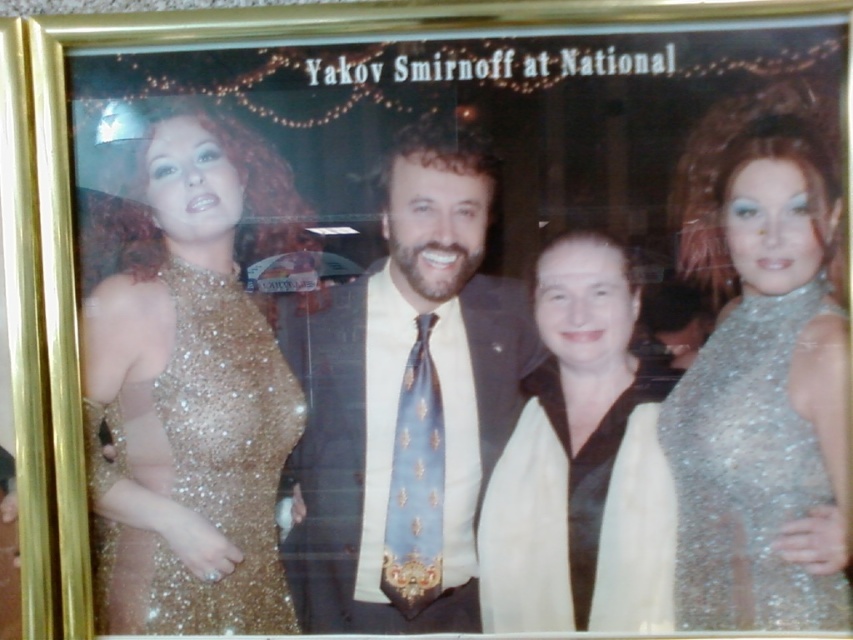
Question: Which point appears closest to the camera in this image?

Choices:
 (A) (558, 573)
 (B) (428, 497)
 (C) (721, 452)

Answer: (C)

Question: Is satin white scarf at center smaller than sparkly silver dress at right?

Choices:
 (A) yes
 (B) no

Answer: (B)

Question: Which object appears farthest from the camera in this image?

Choices:
 (A) sparkly gold dress at left
 (B) light blue silk tie at center
 (C) sparkly silver dress at right

Answer: (B)

Question: Is sparkly gold dress at left to the right of light blue silk tie at center from the viewer's perspective?

Choices:
 (A) no
 (B) yes

Answer: (A)

Question: Does satin white scarf at center appear on the right side of sparkly silver dress at right?

Choices:
 (A) no
 (B) yes

Answer: (A)

Question: Which of these objects is positioned closest to the light blue silk tie at center?

Choices:
 (A) sparkly gold dress at left
 (B) sparkly silver dress at right
 (C) shiny blue tie at center
 (D) satin white scarf at center

Answer: (C)